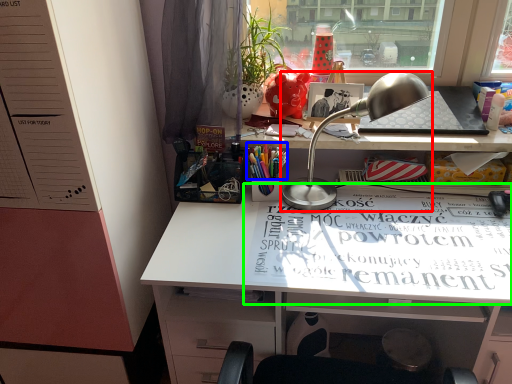
Question: Considering the real-world distances, which object is closest to lamp (highlighted by a red box)? stationery (highlighted by a blue box) or magazine (highlighted by a green box).

Choices:
 (A) stationery
 (B) magazine

Answer: (A)